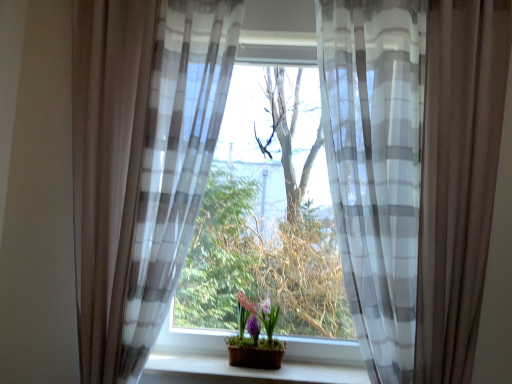
Where is `free space on the front side of matte purple pot at center`? free space on the front side of matte purple pot at center is located at coordinates (253, 374).